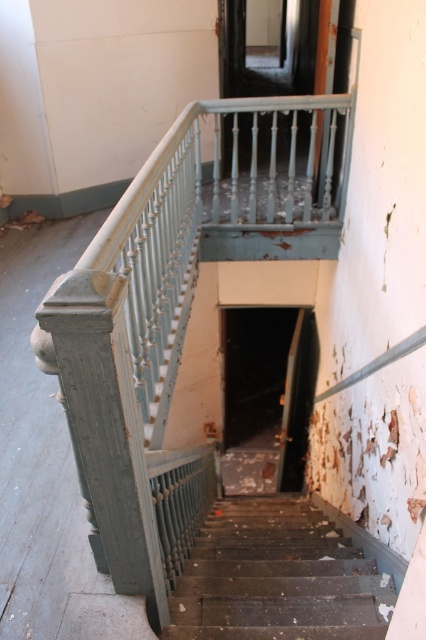
Question: Considering the relative positions of matte gray railing at upper center and dark brown wooden stairs at center in the image provided, where is matte gray railing at upper center located with respect to dark brown wooden stairs at center?

Choices:
 (A) above
 (B) below

Answer: (A)

Question: Among these points, which one is farthest from the camera?

Choices:
 (A) (184, 593)
 (B) (308, 184)

Answer: (B)

Question: Does matte gray railing at upper center appear on the right side of dark brown wooden stairs at center?

Choices:
 (A) yes
 (B) no

Answer: (A)

Question: Which point is closer to the camera?

Choices:
 (A) matte gray railing at upper center
 (B) dark brown wooden stairs at center

Answer: (A)

Question: In this image, where is matte gray railing at upper center located relative to dark brown wooden stairs at center?

Choices:
 (A) above
 (B) below

Answer: (A)